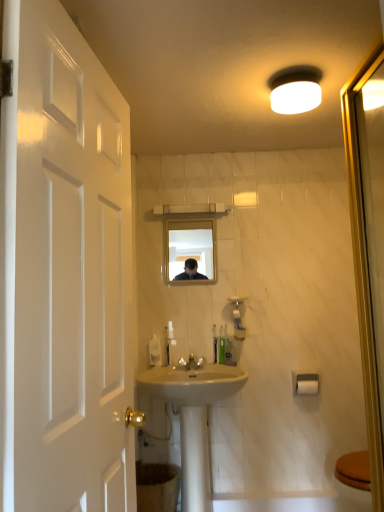
Where is `vacant area that is in front of white plastic soap dispenser at center`? The width and height of the screenshot is (384, 512). vacant area that is in front of white plastic soap dispenser at center is located at coordinates (153, 369).